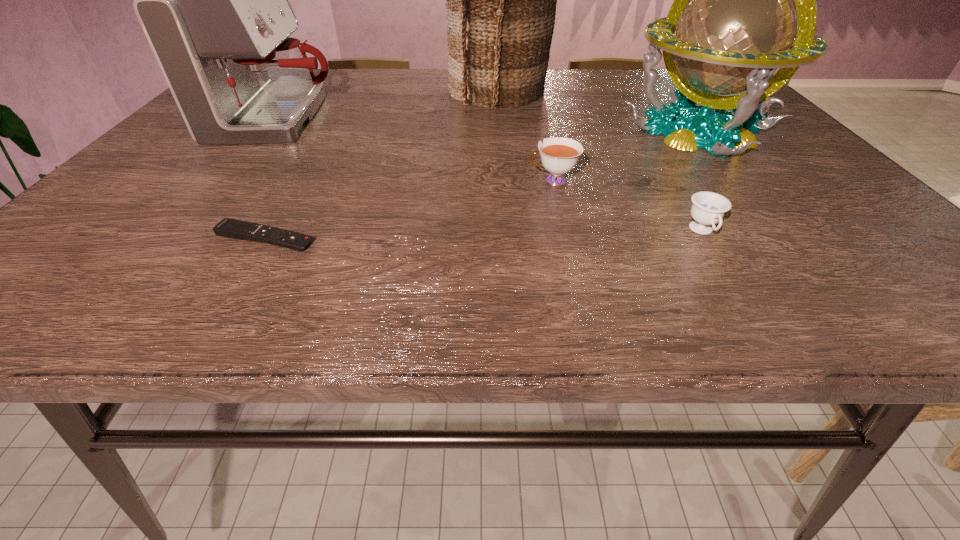
Where is `basket`? basket is located at coordinates (501, 0).

I want to click on globe, so click(x=741, y=24).

Image resolution: width=960 pixels, height=540 pixels. In order to click on coffee maker in this screenshot , I will do `click(212, 0)`.

Identify the location of the farther teacup. The height and width of the screenshot is (540, 960). point(559,155).

Find the location of a particular element. the taller teacup is located at coordinates (559, 155).

Identify the location of the right teacup. (708, 208).

The height and width of the screenshot is (540, 960). Identify the location of the nearer teacup. (708, 208).

The height and width of the screenshot is (540, 960). In order to click on remote control in this screenshot , I will do `click(231, 228)`.

Find the location of `free space located 0.070m on the left of the tallest object`. free space located 0.070m on the left of the tallest object is located at coordinates (424, 90).

Find the location of `blank area located 0.080m on the front of the globe`. blank area located 0.080m on the front of the globe is located at coordinates (747, 187).